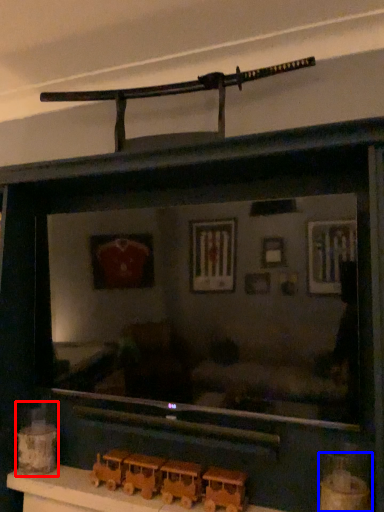
Question: Among these objects, which one is nearest to the camera, toy (highlighted by a red box) or toy (highlighted by a blue box)?

Choices:
 (A) toy
 (B) toy

Answer: (B)